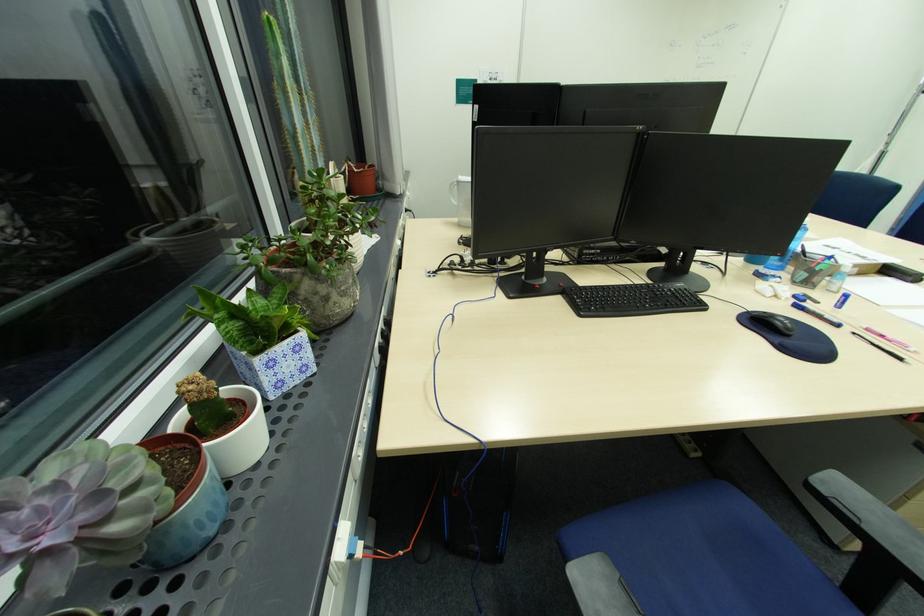
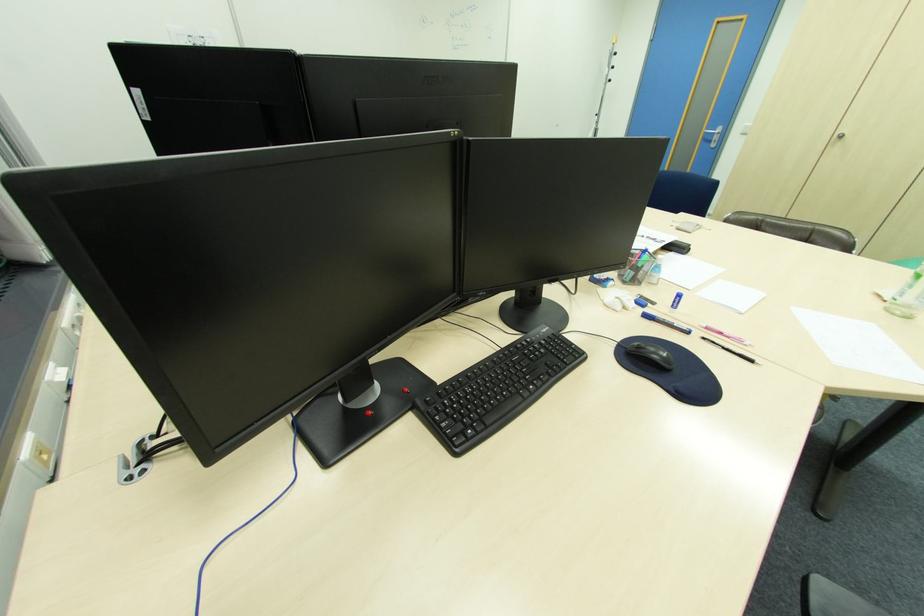
Locate, in the second image, the point that corresponds to [873,330] in the first image.

(712, 328)